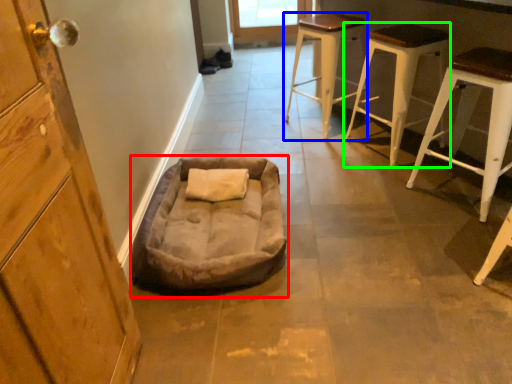
Question: Which object is the closest to the dog bed (highlighted by a red box)? Choose among these: stool (highlighted by a blue box) or stool (highlighted by a green box).

Choices:
 (A) stool
 (B) stool

Answer: (B)